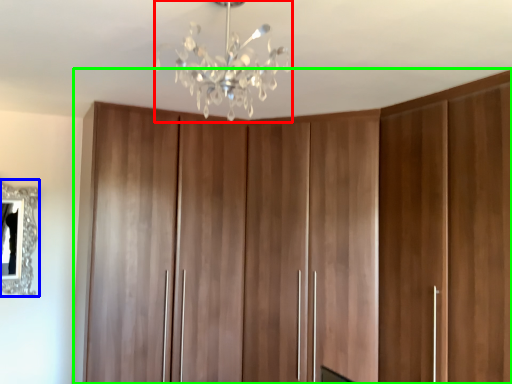
Question: Based on their relative distances, which object is nearer to lamp (highlighted by a red box)? Choose from mirror (highlighted by a blue box) and cupboard (highlighted by a green box).

Choices:
 (A) mirror
 (B) cupboard

Answer: (B)